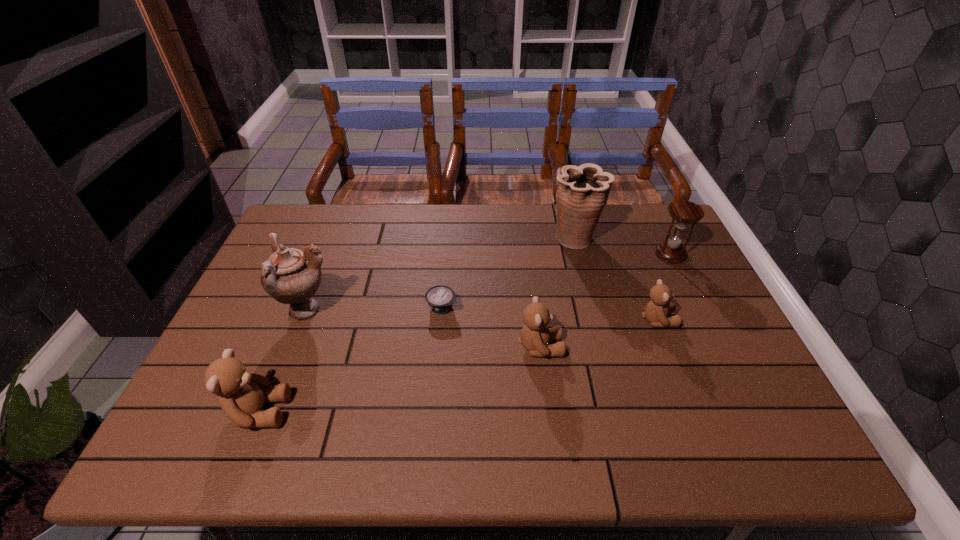
Locate an element on the screen. The image size is (960, 540). hourglass that is positioned at the far edge is located at coordinates (683, 212).

Where is `object that is positioned at the near edge`? This screenshot has width=960, height=540. object that is positioned at the near edge is located at coordinates (242, 395).

Identify the location of teddy bear at the left edge. (242, 395).

Identify the location of urn present at the left edge. (290, 276).

Find the location of a particular element. The width and height of the screenshot is (960, 540). teddy bear that is at the right edge is located at coordinates (655, 311).

Identify the location of hourglass located at the right edge. The image size is (960, 540). pos(683,212).

Where is `object present at the near left corner`? object present at the near left corner is located at coordinates (242, 395).

What are the coordinates of `object at the far right corner` in the screenshot? It's located at (683, 212).

The height and width of the screenshot is (540, 960). In the image, there is a desktop. Identify the location of vacant space at the far edge. (612, 212).

Where is `free space at the near edge of the desktop`? This screenshot has height=540, width=960. free space at the near edge of the desktop is located at coordinates point(670,382).